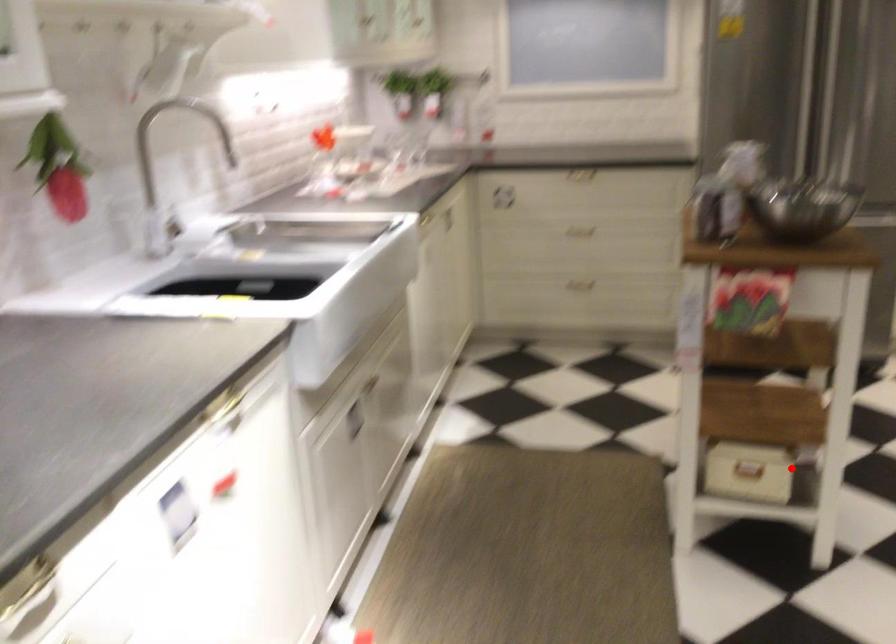
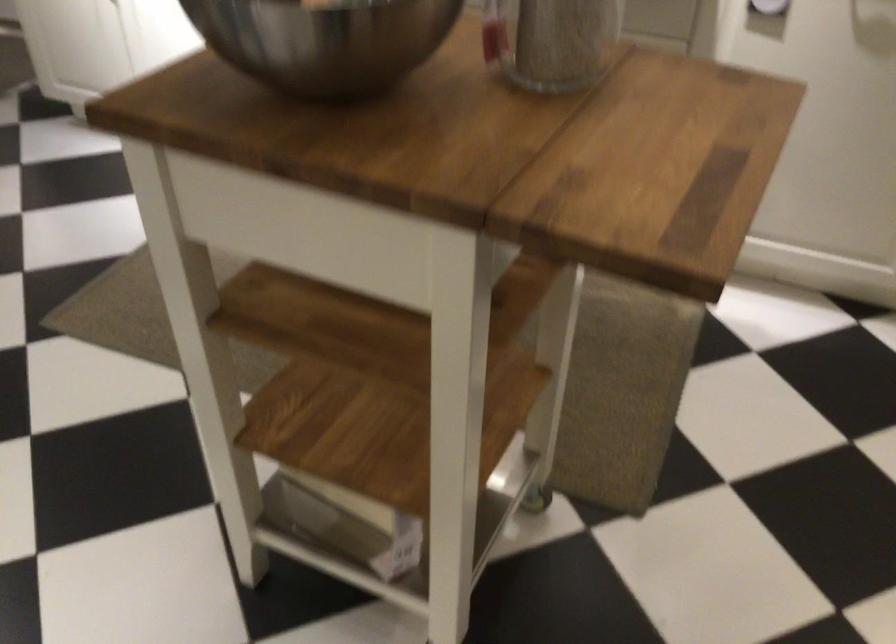
The point at the highlighted location is marked in the first image. Where is the corresponding point in the second image?

(352, 524)